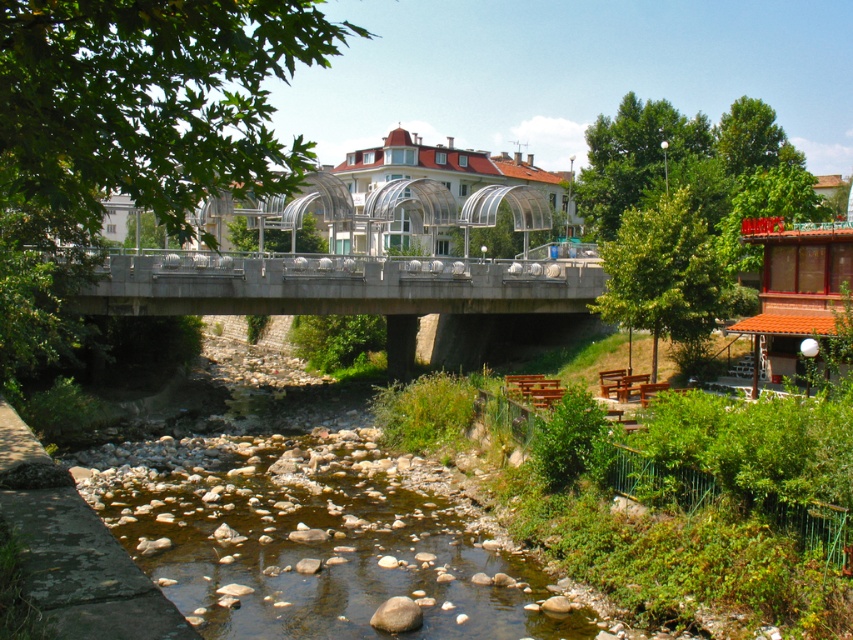
Question: Can you confirm if green leafy tree at lower right is positioned to the left of smooth beige rock at center?

Choices:
 (A) no
 (B) yes

Answer: (A)

Question: Considering the relative positions of concrete bridge at center and smooth beige rock at center in the image provided, where is concrete bridge at center located with respect to smooth beige rock at center?

Choices:
 (A) above
 (B) below

Answer: (A)

Question: Which object appears farthest from the camera in this image?

Choices:
 (A) green leafy tree at center
 (B) green leafy tree at upper right

Answer: (B)

Question: Which object appears closest to the camera in this image?

Choices:
 (A) smooth beige rock at center
 (B) green leafy tree at center
 (C) concrete bridge at center

Answer: (B)

Question: Can you confirm if concrete bridge at center is wider than green leafy tree at lower right?

Choices:
 (A) no
 (B) yes

Answer: (B)

Question: Which of the following is the closest to the observer?

Choices:
 (A) (497, 266)
 (B) (613, 314)

Answer: (B)